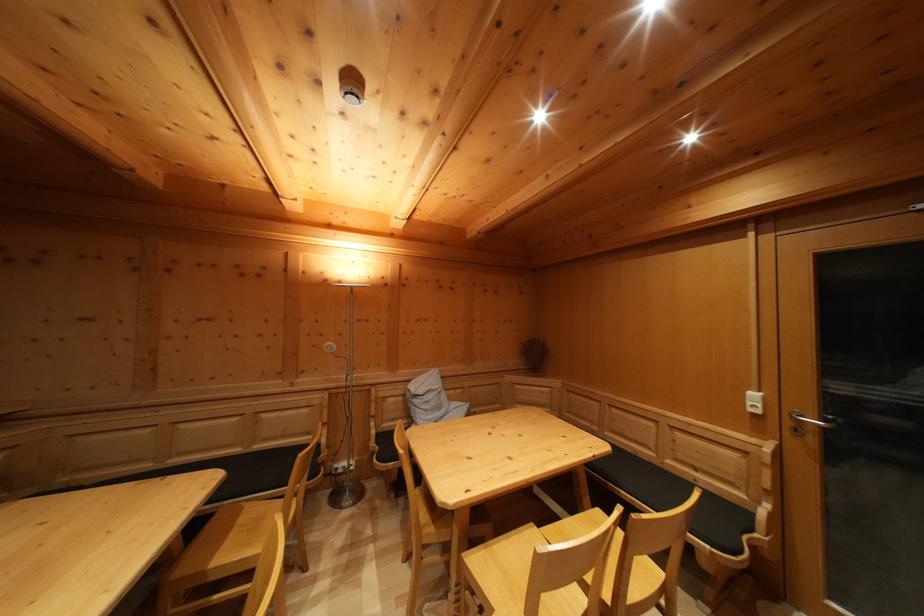
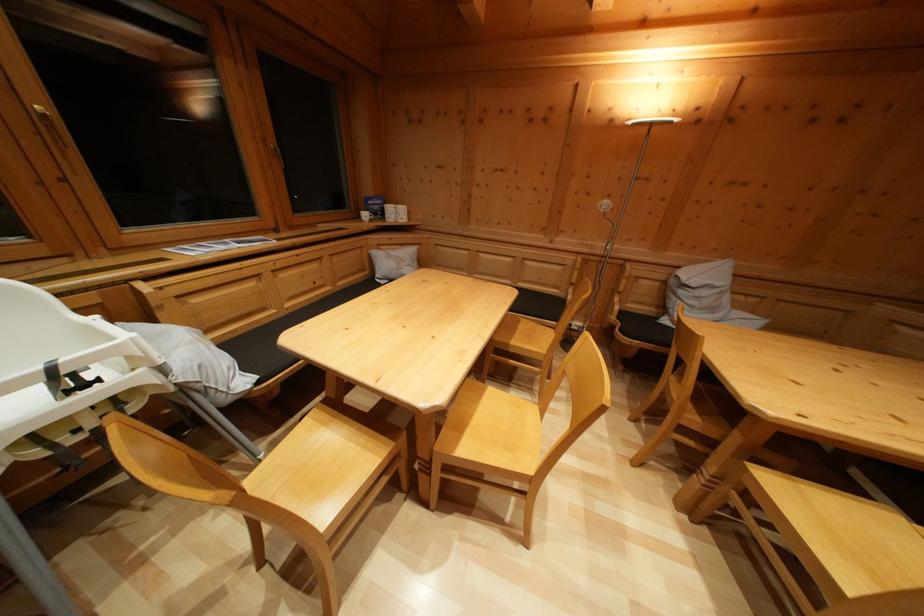
Where in the second image is the point corresponding to the point at 383,440 from the first image?

(626, 318)